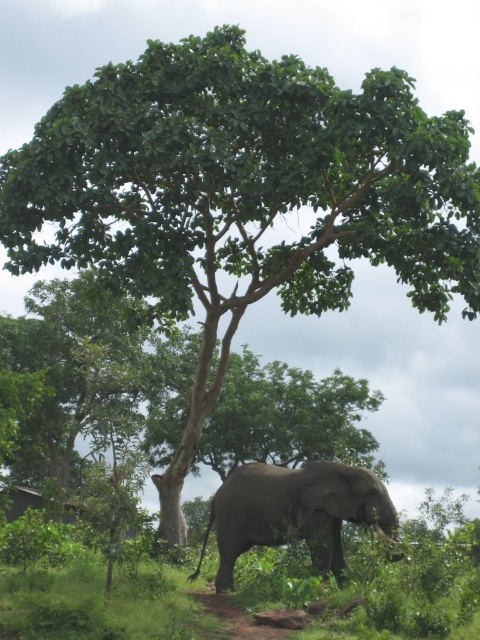
Describe the element at coordinates (91, 378) in the screenshot. I see `green leafy tree at center` at that location.

Is point (336, 392) less distant than point (372, 518)?

No, (336, 392) is behind (372, 518).

Measure the distance between green leafy tree at center and camera.

15.17 meters

Locate an element on the screen. Image resolution: width=480 pixels, height=640 pixels. green leafy tree at center is located at coordinates (91, 378).

Can you confirm if green leafy tree at center is bigger than green leafy grass at lower center?

Yes.

How much distance is there between green leafy tree at center and green leafy grass at lower center?

green leafy tree at center is 19.11 meters away from green leafy grass at lower center.

Does point (38, 410) lie behind point (166, 584)?

Yes, it is behind point (166, 584).

The image size is (480, 640). Identify the location of green leafy tree at center. (91, 378).

Does green leafy grass at lower center have a lesser height compared to gray matte elephant at lower center?

Yes.

Based on the photo, can you confirm if green leafy grass at lower center is positioned below gray matte elephant at lower center?

Yes, green leafy grass at lower center is below gray matte elephant at lower center.

Where is `green leafy grass at lower center`? green leafy grass at lower center is located at coordinates tap(101, 602).

Locate an element on the screen. Image resolution: width=480 pixels, height=640 pixels. green leafy grass at lower center is located at coordinates (101, 602).